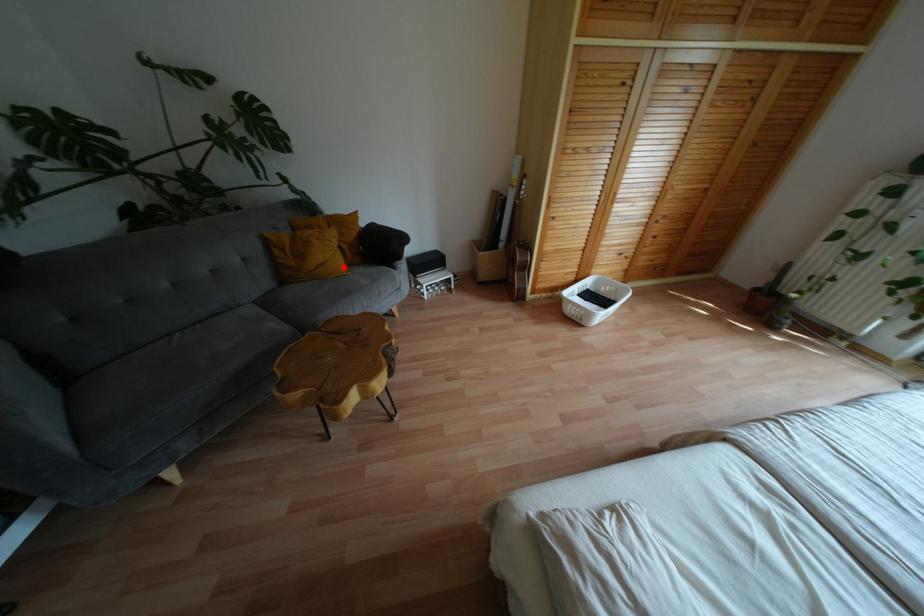
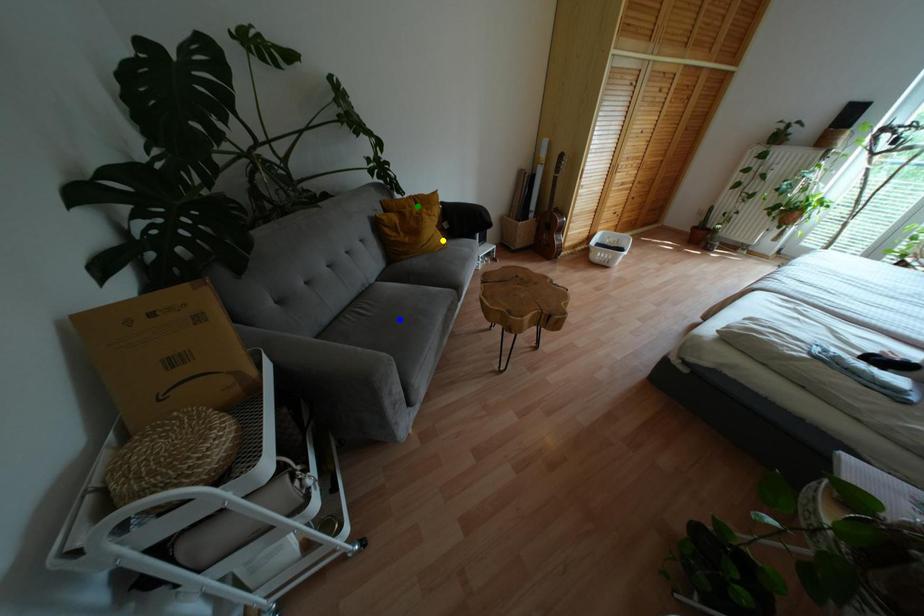
Question: I am providing you with two images of the same scene from different viewpoints. A red point is marked on the first image. You are given multiple points on the second image. Which spot in image 2 lines up with the point in image 1?

Choices:
 (A) yellow point
 (B) blue point
 (C) green point

Answer: (A)